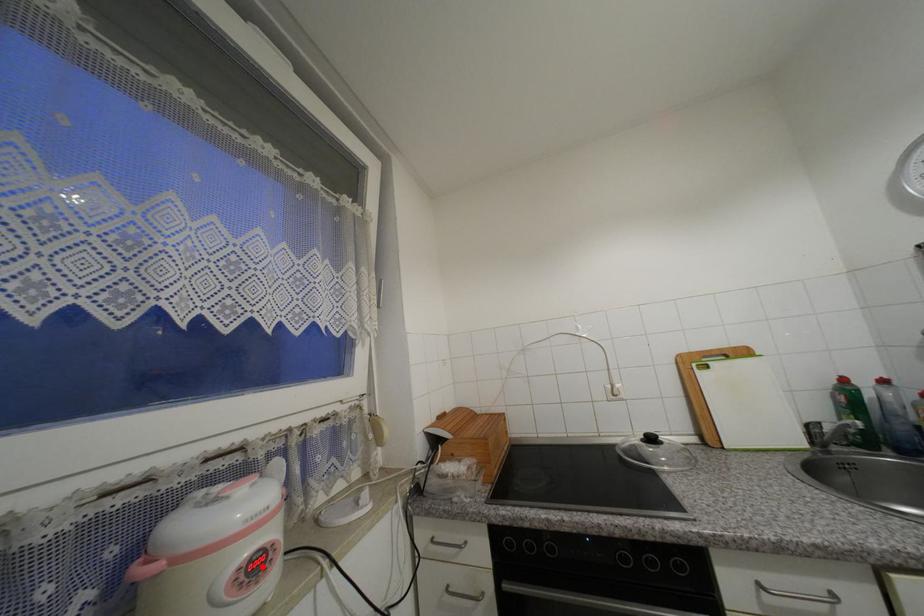
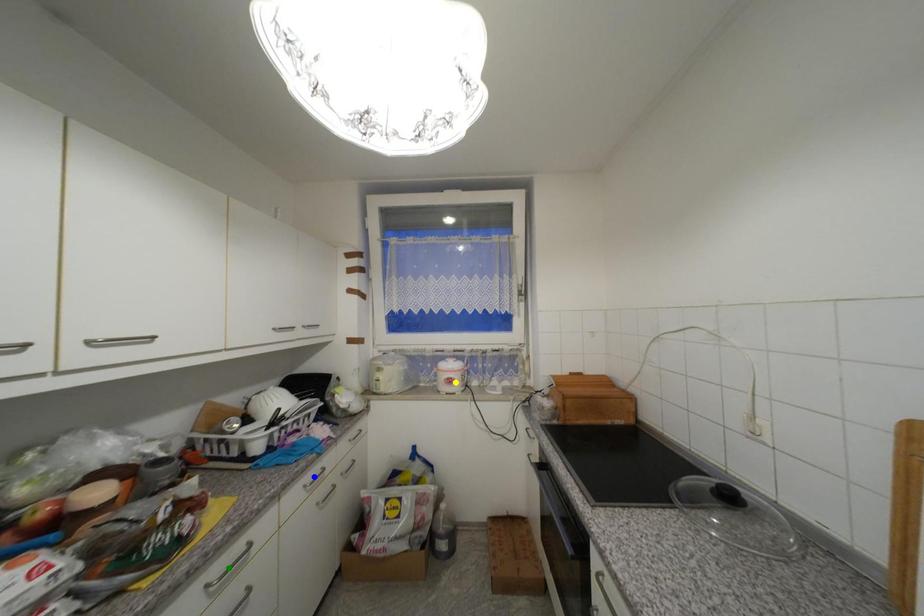
Question: I am providing you with two images of the same scene from different viewpoints. A red point is marked on the first image. You are given multiple points on the second image. Can you choose the point in image 2 that corresponds to the point in image 1?

Choices:
 (A) green point
 (B) yellow point
 (C) blue point

Answer: (B)